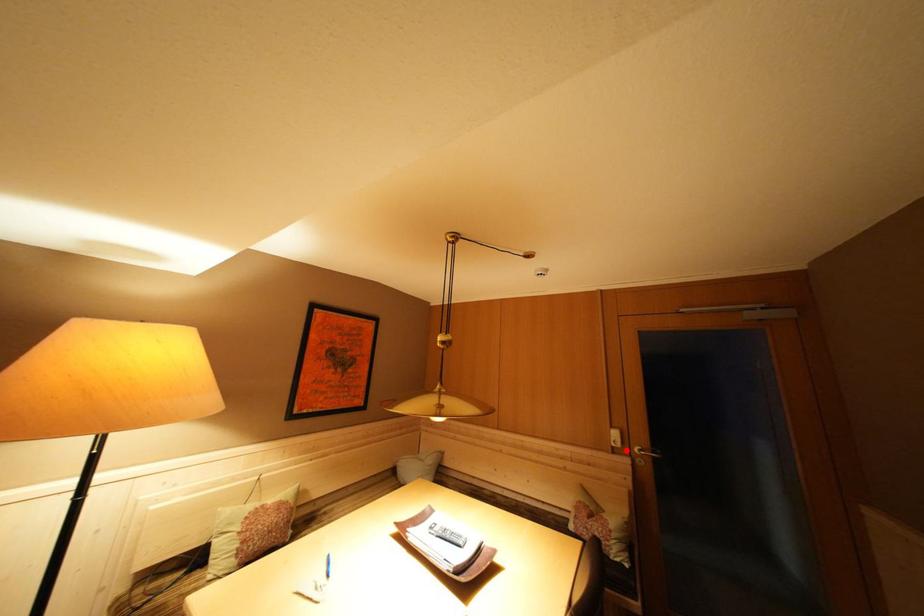
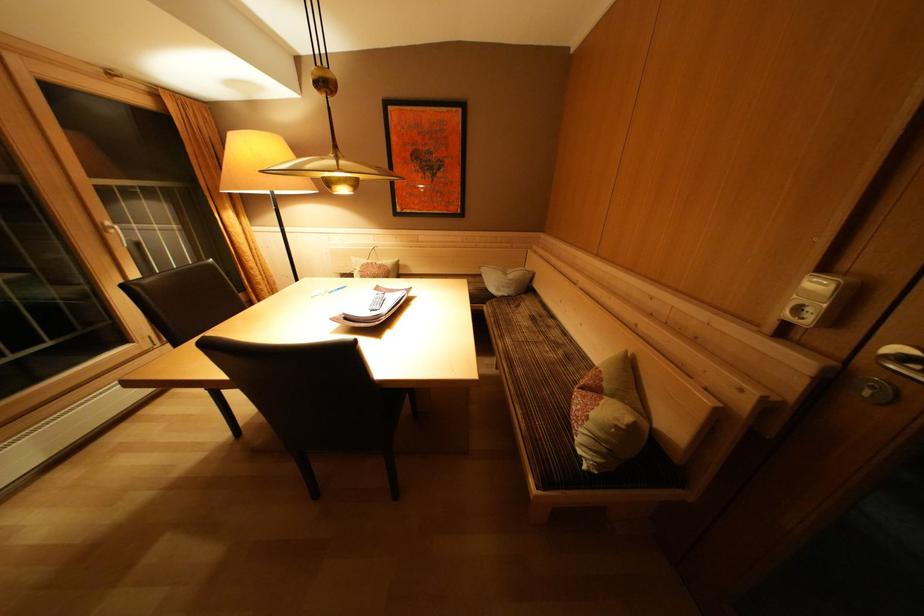
The point at the highlighted location is marked in the first image. Where is the corresponding point in the second image?

(815, 326)